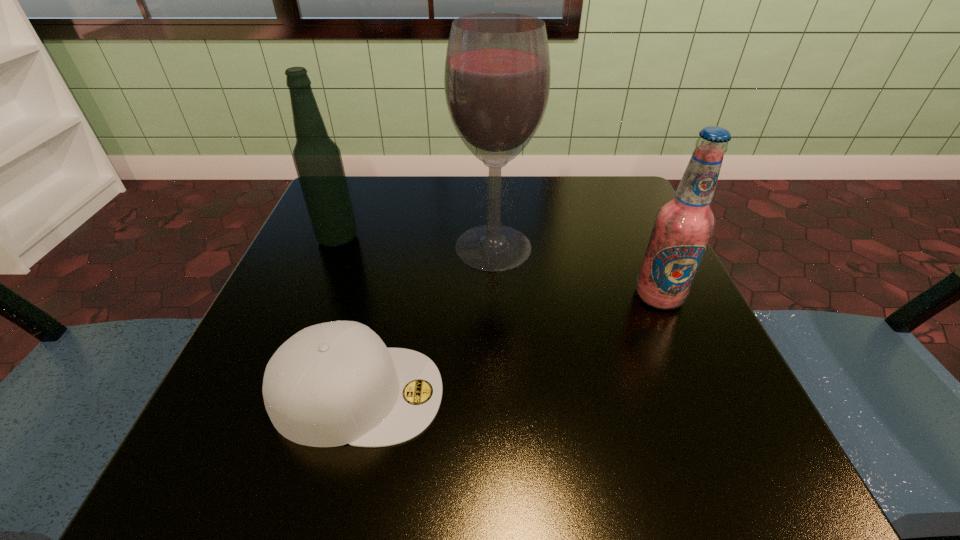
Find the location of a particular element. The width and height of the screenshot is (960, 540). the tallest alcohol is located at coordinates (497, 74).

This screenshot has width=960, height=540. Find the location of `the tallest object`. the tallest object is located at coordinates (497, 74).

The image size is (960, 540). Find the location of `the leftmost alcohol`. the leftmost alcohol is located at coordinates (317, 159).

In order to click on the rightmost object in this screenshot , I will do `click(683, 226)`.

Locate an element on the screen. This screenshot has height=540, width=960. the nearest alcohol is located at coordinates (683, 226).

Where is `the nearest object`? The height and width of the screenshot is (540, 960). the nearest object is located at coordinates (335, 383).

Identify the location of cap. The height and width of the screenshot is (540, 960). (335, 383).

The image size is (960, 540). I want to click on vacant space located 0.280m on the left of the tallest object, so click(x=312, y=247).

Identify the location of vacant region located on the right of the leftmost alcohol. (393, 239).

Where is `vacant space located 0.060m on the front of the rightmost alcohol`? The image size is (960, 540). vacant space located 0.060m on the front of the rightmost alcohol is located at coordinates (679, 341).